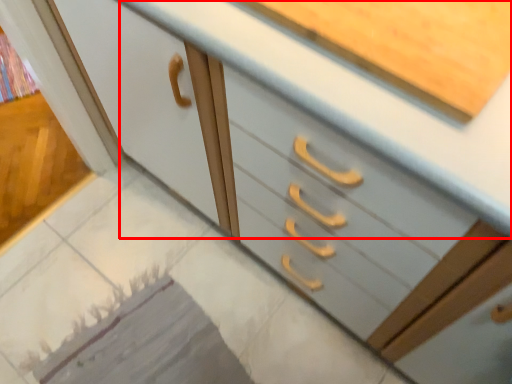
Question: From the image's perspective, where is counter top (annotated by the red box) located in relation to tile in the image?

Choices:
 (A) above
 (B) below

Answer: (A)